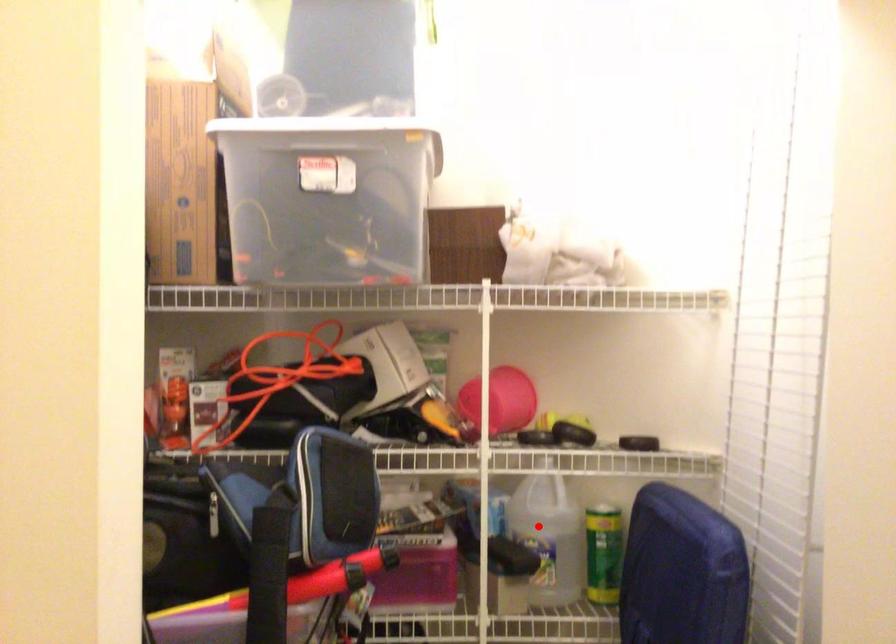
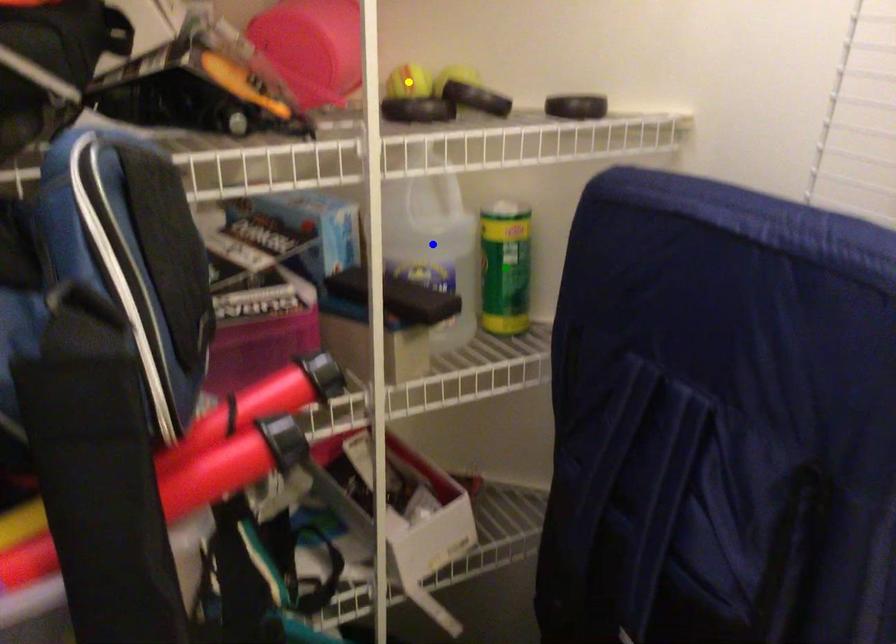
Question: I am providing you with two images of the same scene from different viewpoints. A red point is marked on the first image. You are given multiple points on the second image. Which point in image 2 represents the same 3d spot as the red point in image 1?

Choices:
 (A) yellow point
 (B) green point
 (C) blue point

Answer: (C)